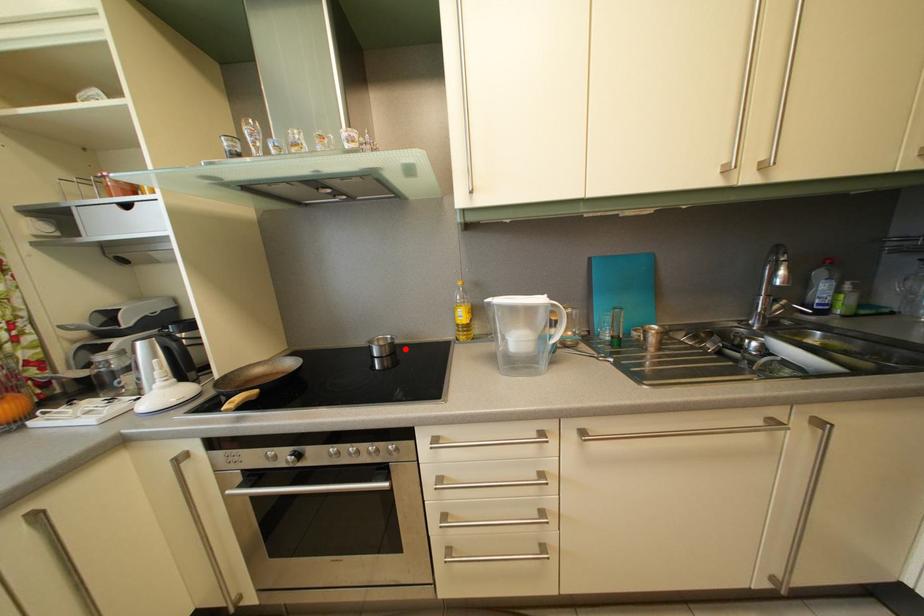
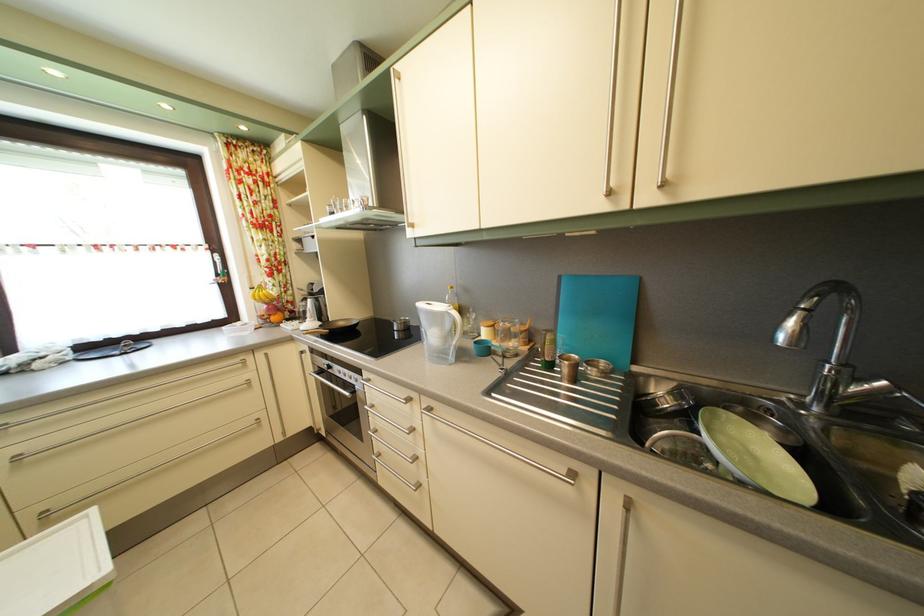
Find the pixel in the second image that matches the highlighted location in the first image.

(420, 331)